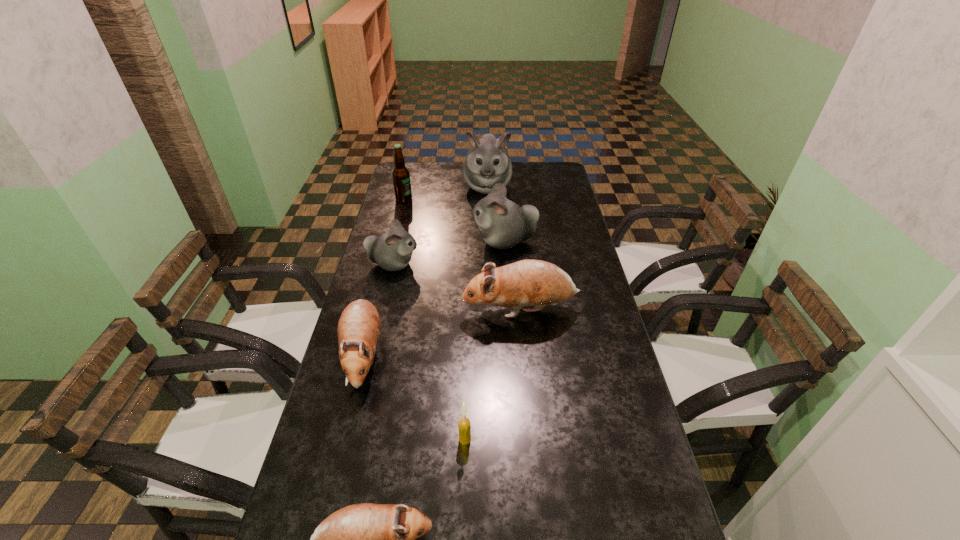
The height and width of the screenshot is (540, 960). Find the location of `free space between the second smallest white hamster and the cream candle`. free space between the second smallest white hamster and the cream candle is located at coordinates (485, 340).

This screenshot has height=540, width=960. Identify the location of object that can be found as the second closest to the biggest white hamster. (401, 176).

Image resolution: width=960 pixels, height=540 pixels. I want to click on object that is the fourth closest one to the nearest brown hamster, so click(392, 251).

Find the location of a particular element. hamster that is the sixth closest to the beer bottle is located at coordinates (367, 539).

Select which hamster is the third closest to the beer bottle. Please provide its 2D coordinates. Your answer should be formatted as a tuple, i.e. [(x, y)], where the tuple contains the x and y coordinates of a point satisfying the conditions above.

[(392, 251)]

Locate which white hamster ranks second in proximity to the biggest brown hamster. Please provide its 2D coordinates. Your answer should be formatted as a tuple, i.e. [(x, y)], where the tuple contains the x and y coordinates of a point satisfying the conditions above.

[(503, 224)]

Point out which white hamster is positioned as the third nearest to the second smallest brown hamster. Please provide its 2D coordinates. Your answer should be formatted as a tuple, i.e. [(x, y)], where the tuple contains the x and y coordinates of a point satisfying the conditions above.

[(487, 163)]

In order to click on brown hamster object that ranks as the second closest to the smallest white hamster in this screenshot , I will do `click(359, 325)`.

Choose which brown hamster is the second nearest neighbor to the beer bottle. Please provide its 2D coordinates. Your answer should be formatted as a tuple, i.e. [(x, y)], where the tuple contains the x and y coordinates of a point satisfying the conditions above.

[(359, 325)]

Locate an element on the screen. The height and width of the screenshot is (540, 960). free region that satisfies the following two spatial constraints: 1. on the face of the second biggest white hamster; 2. at the face of the second smallest brown hamster is located at coordinates (512, 355).